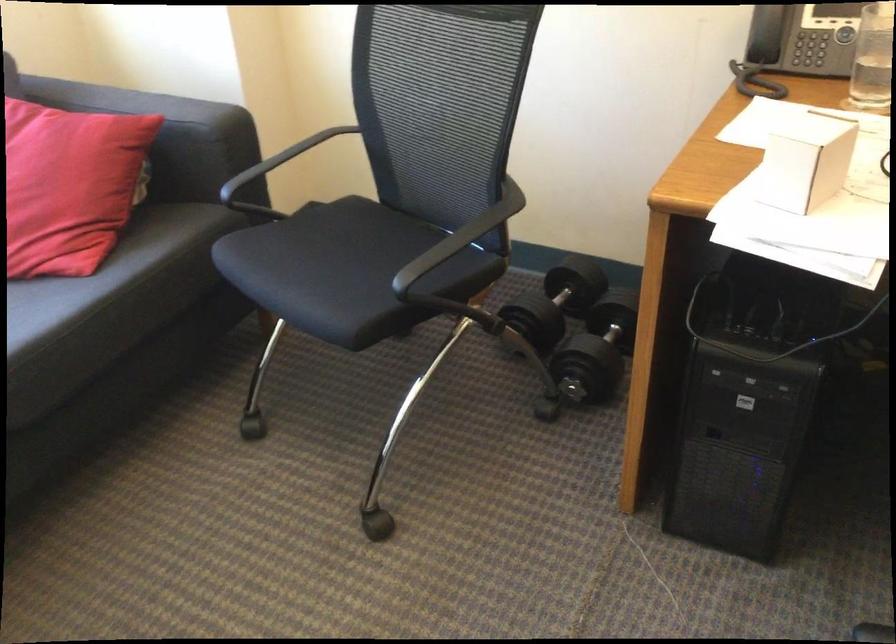
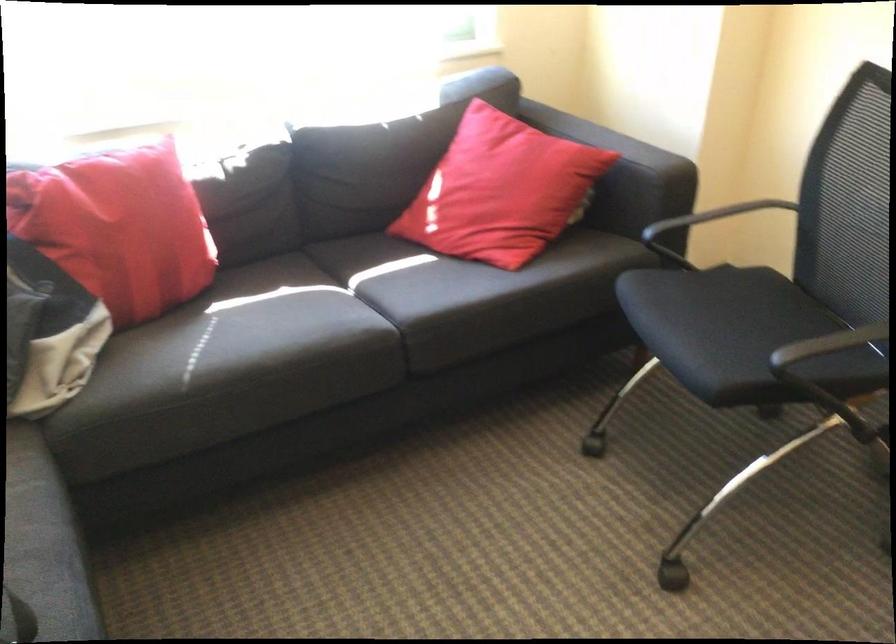
The point at (153, 102) is marked in the first image. Where is the corresponding point in the second image?

(616, 140)